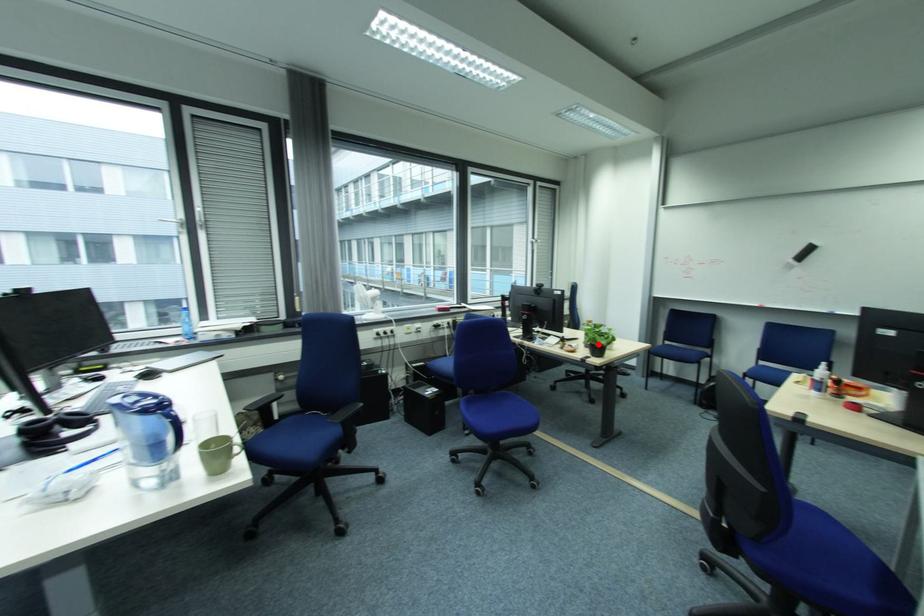
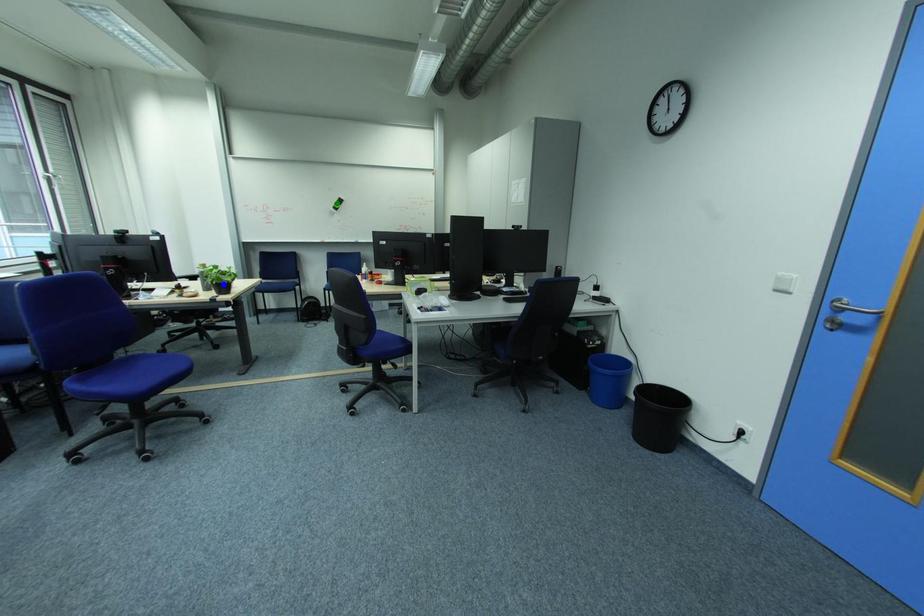
Question: I am providing you with two images of the same scene from different viewpoints. A red point is marked on the first image. You are given multiple points on the second image. Can you choose the point in image 2 that corresponds to the point in image 1?

Choices:
 (A) blue point
 (B) yellow point
 (C) green point

Answer: (A)